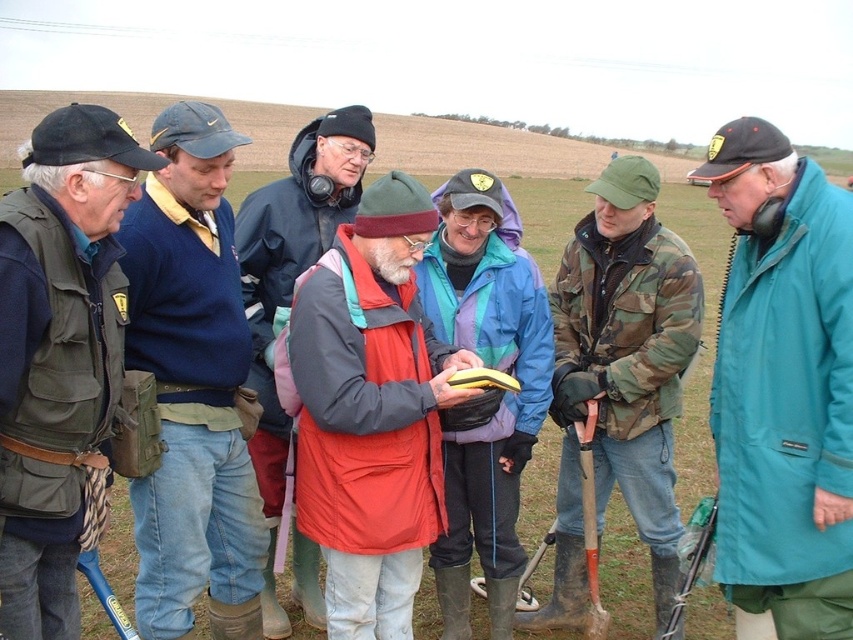
You are standing at the point marked as point (819,616) in the image. You want to walk straight ahead. How far will you have to walk before you can no longer see the group of seven individuals in the background?

Since the point (819,616) and the viewer are 3.31 meters apart from each other, you would have to walk 3.31 meters straight ahead before you can no longer see the group of seven individuals in the background.

You are standing in the rural setting shown in the image and want to walk from the point at coordinates point (32, 403) to the point at coordinates point (343, 122). Which direction should you face to move towards the second point?

To move from point (32, 403) to point (343, 122), you should face north because point (343, 122) is further away from the camera compared to point (32, 403), indicating it is located in the northern direction.